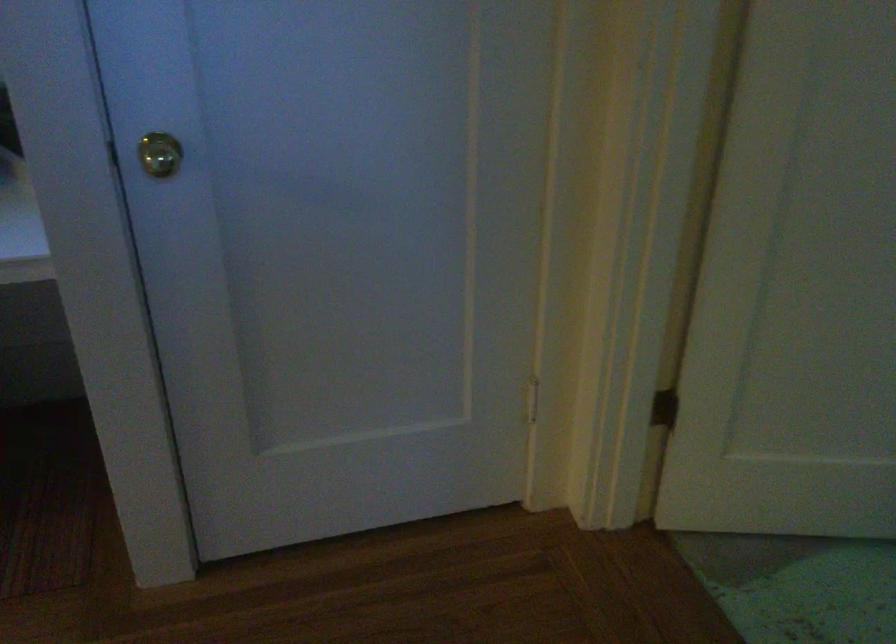
Image resolution: width=896 pixels, height=644 pixels. What do you see at coordinates (159, 154) in the screenshot?
I see `the gold door knob` at bounding box center [159, 154].